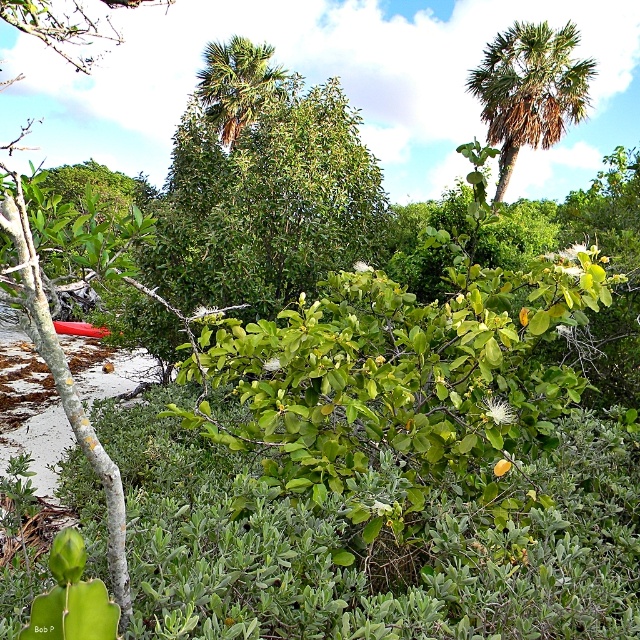
You are standing in the tropical coastal scene and want to take a photo of the brown textured palm tree at upper right. To avoid blocking the palm tree in your shot, should you move to the right or left of the green leafy bush at center?

You should move to the right of the green leafy bush at center. Since the green leafy bush at center is to the left of the brown textured palm tree at upper right, moving to the right of the bush will keep it between you and the palm tree, thus avoiding blocking the palm tree in your photo.